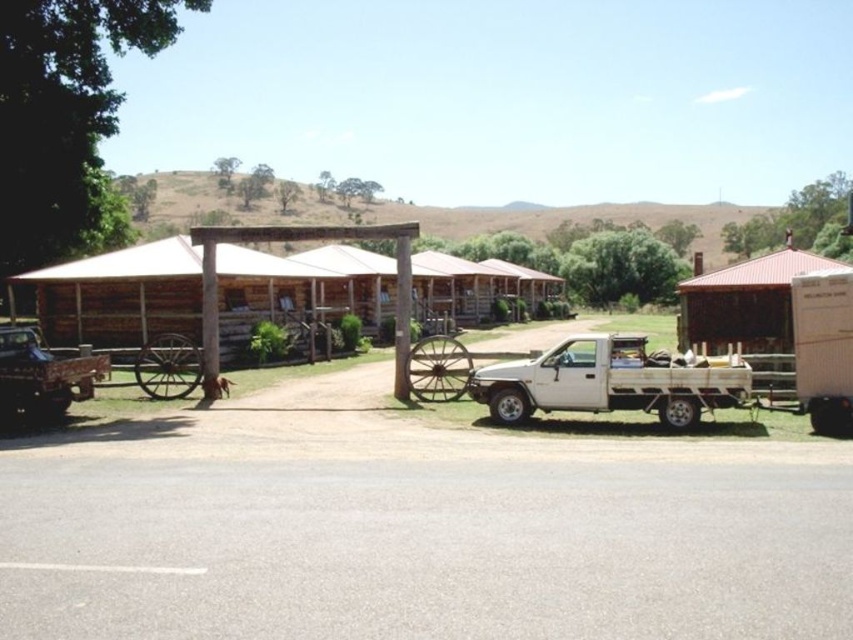
Is point (115, 301) farther from camera compared to point (705, 284)?

Yes.

Measure the distance between point (322, 252) and camera.

Point (322, 252) and camera are 127.30 feet apart.

I want to click on brown wooden hut at center, so click(265, 296).

From the picture: Does brown wooden hut at center have a greater height compared to white matte truck at center?

Correct, brown wooden hut at center is much taller as white matte truck at center.

I want to click on brown wooden hut at center, so click(265, 296).

Identify the location of brown wooden hut at center. The image size is (853, 640). (265, 296).

Is rustic wooden hut at right positioned behind white matte truck at right?

Yes, it is behind white matte truck at right.

Which of these two, rustic wooden hut at right or white matte truck at right, stands taller?

Standing taller between the two is rustic wooden hut at right.

Who is more forward, (682,346) or (836,349)?

Point (836,349)

You are a GUI agent. You are given a task and a screenshot of the screen. Output one action in this format:
    pyautogui.click(x=<x>, y=<y>)
    Task: Click on the rustic wooden hut at right
    
    Given the screenshot: What is the action you would take?
    pyautogui.click(x=749, y=314)